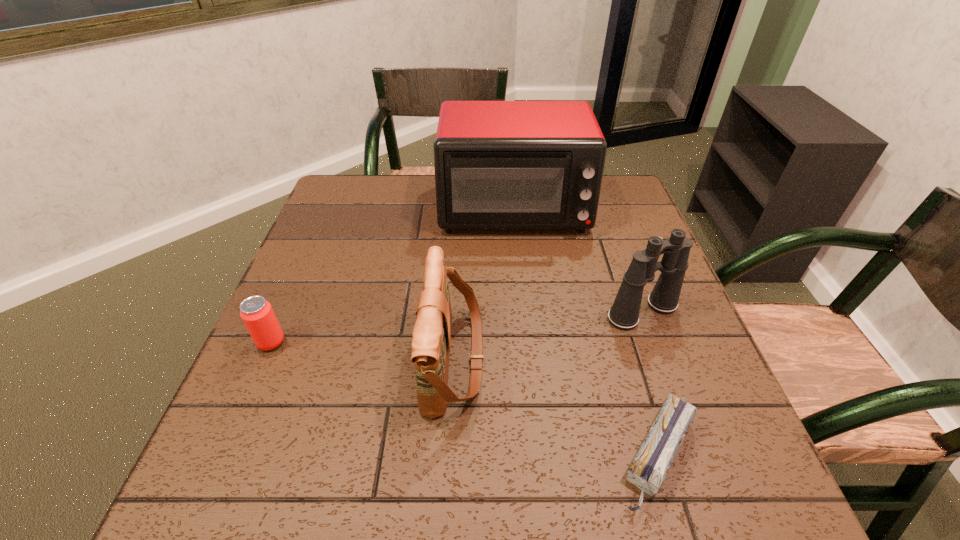
Image resolution: width=960 pixels, height=540 pixels. I want to click on free space that satisfies the following two spatial constraints: 1. on the front-facing side of the toaster oven; 2. on the front-facing side of the shoulder bag, so click(x=528, y=359).

The image size is (960, 540). I want to click on blank space that satisfies the following two spatial constraints: 1. on the front-facing side of the shortest object; 2. on the left side of the farthest object, so click(x=538, y=456).

Find the location of a particular element. The height and width of the screenshot is (540, 960). free spot that satisfies the following two spatial constraints: 1. on the front-facing side of the farthest object; 2. on the front-facing side of the shoulder bag is located at coordinates (528, 359).

Where is `free space in the image that satisfies the following two spatial constraints: 1. on the front-facing side of the tallest object; 2. on the right side of the binoculars`? This screenshot has width=960, height=540. free space in the image that satisfies the following two spatial constraints: 1. on the front-facing side of the tallest object; 2. on the right side of the binoculars is located at coordinates (523, 312).